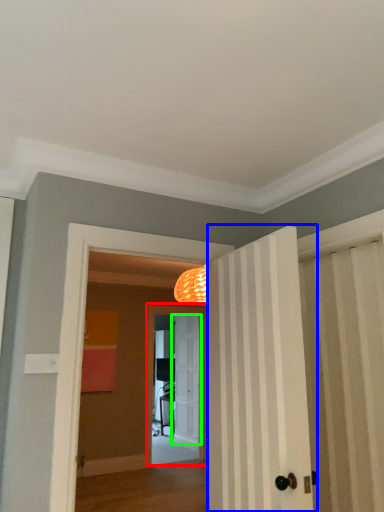
Question: Based on their relative distances, which object is farther from screen door (highlighted by a red box)? Choose from door (highlighted by a blue box) and door (highlighted by a green box).

Choices:
 (A) door
 (B) door

Answer: (A)